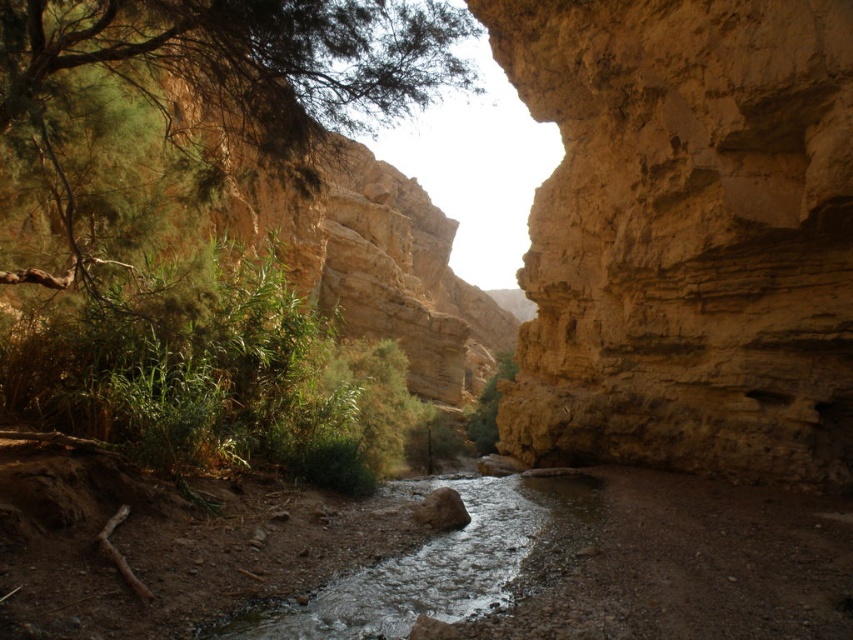
Which is more to the right, matte yellow rock at center or green leafy tree at center?

matte yellow rock at center

Locate an element on the screen. Image resolution: width=853 pixels, height=640 pixels. matte yellow rock at center is located at coordinates (686, 234).

Where is `matte yellow rock at center`? Image resolution: width=853 pixels, height=640 pixels. matte yellow rock at center is located at coordinates (686, 234).

Does green leafy tree at upper left appear on the left side of green leafy tree at center?

Correct, you'll find green leafy tree at upper left to the left of green leafy tree at center.

Is point (306, 36) positioned before point (492, 435)?

That is True.

Where is `green leafy tree at upper left`? The height and width of the screenshot is (640, 853). green leafy tree at upper left is located at coordinates tap(244, 60).

Is matte yellow rock at center bigger than green leafy tree at upper left?

Correct, matte yellow rock at center is larger in size than green leafy tree at upper left.

Is point (750, 433) more distant than point (158, 60)?

Yes, it is.

Identify the location of matte yellow rock at center. This screenshot has width=853, height=640. (686, 234).